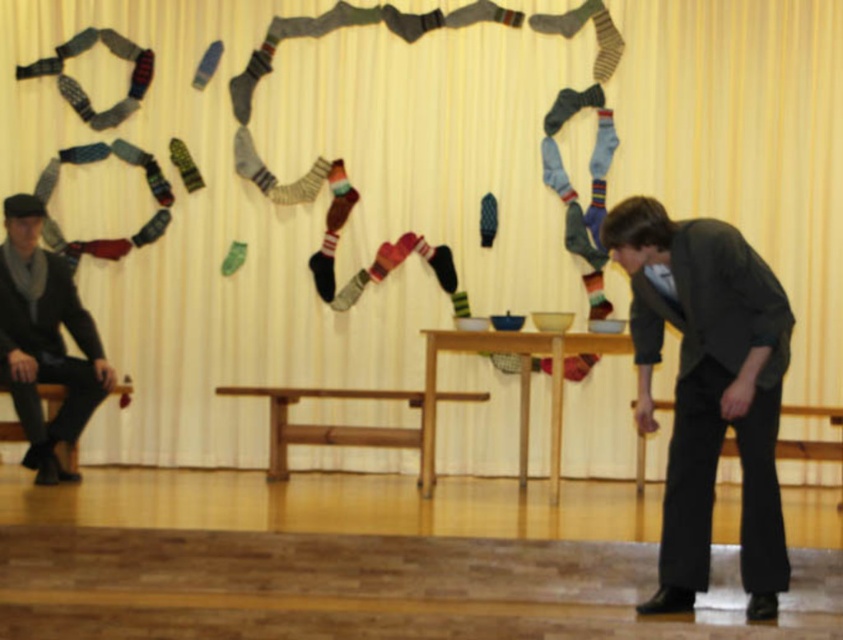
You are standing in the center of the hall and want to move towards the dark gray suit at right. Which direction should you walk?

You should walk towards the right side of the hall to reach the dark gray suit at right since it is located at point [707,390], which is to the right relative to the center position.